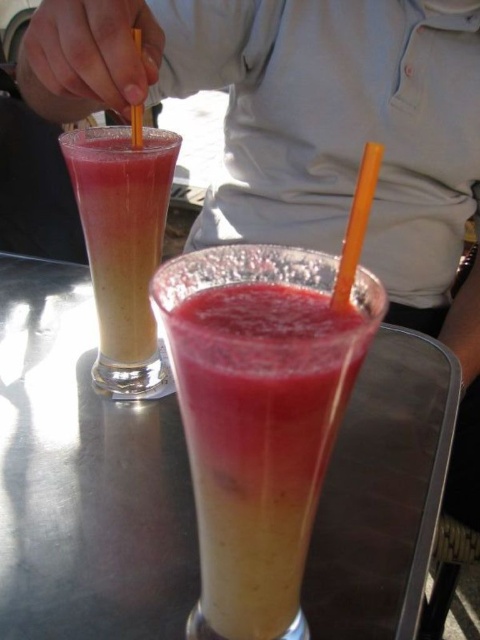
Question: Among these points, which one is farthest from the camera?

Choices:
 (A) (136, 118)
 (B) (340, 253)
 (C) (137, 252)

Answer: (B)

Question: Can you confirm if smooth matte juice at center is positioned to the left of orange plastic straw at center?

Choices:
 (A) yes
 (B) no

Answer: (A)

Question: Does translucent glass juice at left have a smaller size compared to orange plastic straw at upper center?

Choices:
 (A) no
 (B) yes

Answer: (A)

Question: Which of the following is the closest to the observer?

Choices:
 (A) translucent glass at center
 (B) translucent glass juice at left
 (C) orange plastic straw at center
 (D) orange plastic straw at upper center

Answer: (C)

Question: Does orange plastic straw at center have a lesser width compared to orange plastic straw at upper center?

Choices:
 (A) yes
 (B) no

Answer: (B)

Question: Which point is closer to the camera taking this photo?

Choices:
 (A) (171, 150)
 (B) (348, 278)
 (C) (327, 612)
 (D) (297, 472)

Answer: (D)